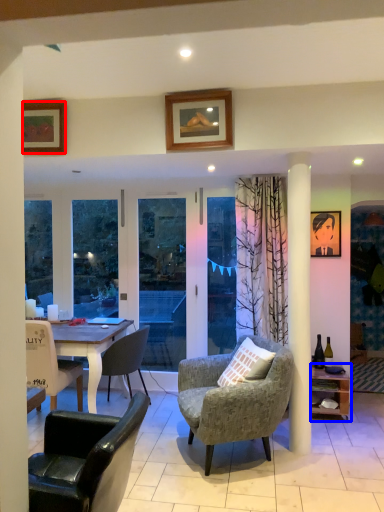
Question: Among these objects, which one is farthest to the camera, picture frame (highlighted by a red box) or shelf (highlighted by a blue box)?

Choices:
 (A) picture frame
 (B) shelf

Answer: (B)